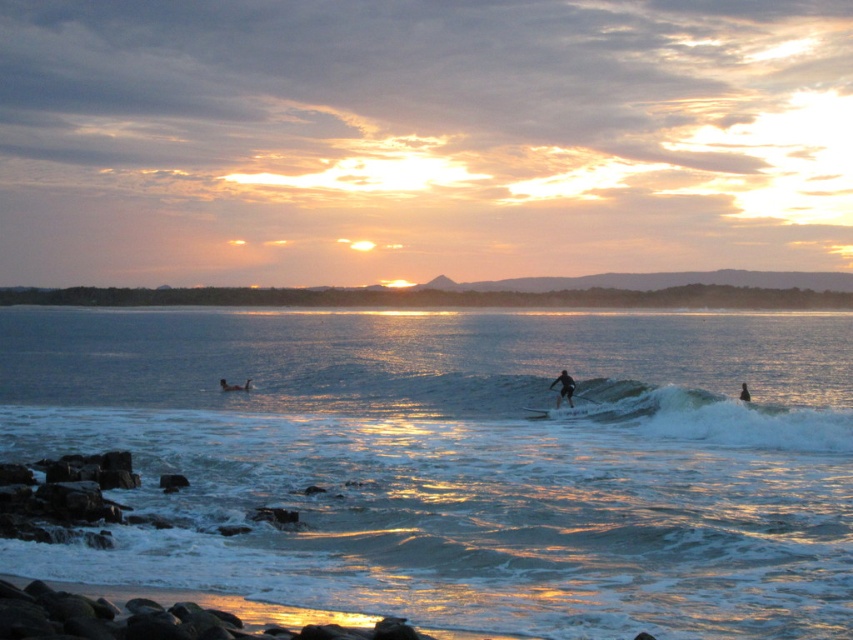
Question: Which object appears closest to the camera in this image?

Choices:
 (A) dark blue wetsuit at lower right
 (B) smooth black wetsuit at center
 (C) clear water at center

Answer: (C)

Question: Is white foam surfboard at center above dark blue wetsuit at lower right?

Choices:
 (A) no
 (B) yes

Answer: (A)

Question: Which object is positioned closest to the clear water at center?

Choices:
 (A) dark blue wetsuit at lower right
 (B) smooth skin person at center
 (C) white foam surfboard at center

Answer: (B)

Question: From the image, what is the correct spatial relationship of smooth black wetsuit at center in relation to dark blue wetsuit at lower right?

Choices:
 (A) left
 (B) right

Answer: (A)

Question: Which point appears farthest from the camera in this image?

Choices:
 (A) (231, 388)
 (B) (741, 387)

Answer: (A)

Question: Can you confirm if smooth skin person at center is positioned below dark blue wetsuit at lower right?

Choices:
 (A) yes
 (B) no

Answer: (A)